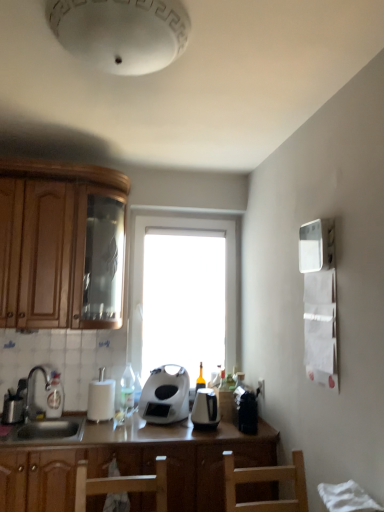
Question: Considering the relative sizes of white matte toaster at center, arranged as the 1th kitchen appliance when viewed from the left, and black plastic coffee machine at lower right in the image provided, is white matte toaster at center, arranged as the 1th kitchen appliance when viewed from the left, taller than black plastic coffee machine at lower right?

Choices:
 (A) yes
 (B) no

Answer: (A)

Question: Can you confirm if white matte toaster at center, which is the second kitchen appliance from right to left, is thinner than black plastic coffee machine at lower right?

Choices:
 (A) no
 (B) yes

Answer: (B)

Question: Does white matte toaster at center, arranged as the 1th kitchen appliance when viewed from the left, have a lesser height compared to black plastic coffee machine at lower right?

Choices:
 (A) yes
 (B) no

Answer: (B)

Question: Is white matte toaster at center, which is the second kitchen appliance from right to left, further to camera compared to black plastic coffee machine at lower right?

Choices:
 (A) no
 (B) yes

Answer: (B)

Question: Is white matte toaster at center, which is the second kitchen appliance from right to left, wider than black plastic coffee machine at lower right?

Choices:
 (A) yes
 (B) no

Answer: (B)

Question: Is translucent glass bottle at sink left, arranged as the 1th bottle when viewed from the left, far away from transparent glass window at center?

Choices:
 (A) no
 (B) yes

Answer: (A)

Question: Does translucent glass bottle at sink left, marked as the 2th bottle in a right-to-left arrangement, have a smaller size compared to transparent glass window at center?

Choices:
 (A) yes
 (B) no

Answer: (A)

Question: Is translucent glass bottle at sink left, arranged as the 1th bottle when viewed from the left, placed right next to transparent glass window at center?

Choices:
 (A) yes
 (B) no

Answer: (B)

Question: Can you confirm if translucent glass bottle at sink left, marked as the 2th bottle in a right-to-left arrangement, is wider than transparent glass window at center?

Choices:
 (A) yes
 (B) no

Answer: (B)

Question: Considering the relative sizes of translucent glass bottle at sink left, arranged as the 1th bottle when viewed from the left, and transparent glass window at center in the image provided, is translucent glass bottle at sink left, arranged as the 1th bottle when viewed from the left, shorter than transparent glass window at center?

Choices:
 (A) no
 (B) yes

Answer: (B)

Question: Does translucent glass bottle at sink left, arranged as the 1th bottle when viewed from the left, turn towards transparent glass window at center?

Choices:
 (A) yes
 (B) no

Answer: (B)

Question: From the image's perspective, is white glossy bottle at center, which is the 1th bottle from right to left, over white matte paper towel holder at center?

Choices:
 (A) no
 (B) yes

Answer: (B)